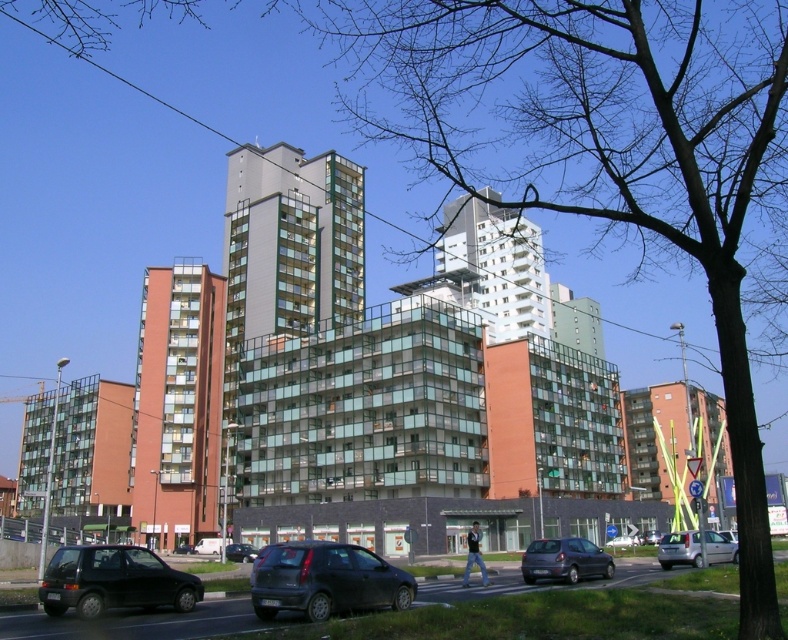
Which is more to the right, dark gray metallic hatchback at lower center or matte black car at center?

dark gray metallic hatchback at lower center

Is dark gray metallic hatchback at lower center shorter than matte black car at center?

Yes, dark gray metallic hatchback at lower center is shorter than matte black car at center.

Between point (523, 570) and point (231, 552), which one is positioned in front?

Positioned in front is point (523, 570).

Where is `dark gray metallic hatchback at lower center`? dark gray metallic hatchback at lower center is located at coordinates (563, 561).

Is dark gray matte hatchback at lower center positioned at the back of dark gray metallic hatchback at lower center?

No, it is not.

Is dark gray matte hatchback at lower center shorter than dark gray metallic hatchback at lower center?

No, dark gray matte hatchback at lower center is not shorter than dark gray metallic hatchback at lower center.

Who is more forward, (x=396, y=605) or (x=533, y=572)?

Positioned in front is point (x=396, y=605).

The height and width of the screenshot is (640, 788). In order to click on dark gray matte hatchback at lower center in this screenshot , I will do `click(325, 580)`.

Consider the image. Can you confirm if matte black car at lower left is wider than dark gray metallic hatchback at lower center?

Yes.

Which is more to the right, matte black car at lower left or dark gray metallic hatchback at lower center?

From the viewer's perspective, dark gray metallic hatchback at lower center appears more on the right side.

The image size is (788, 640). I want to click on matte black car at lower left, so tap(113, 580).